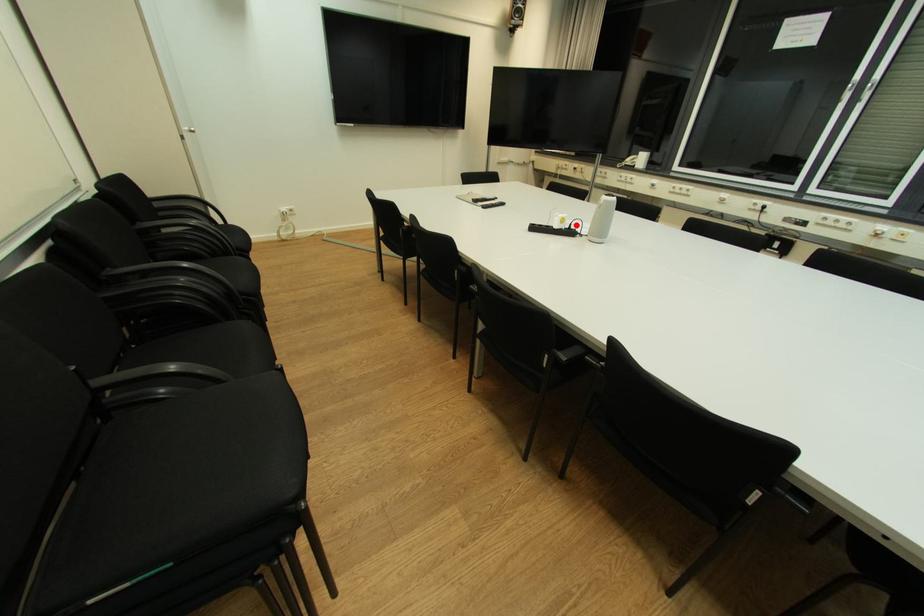
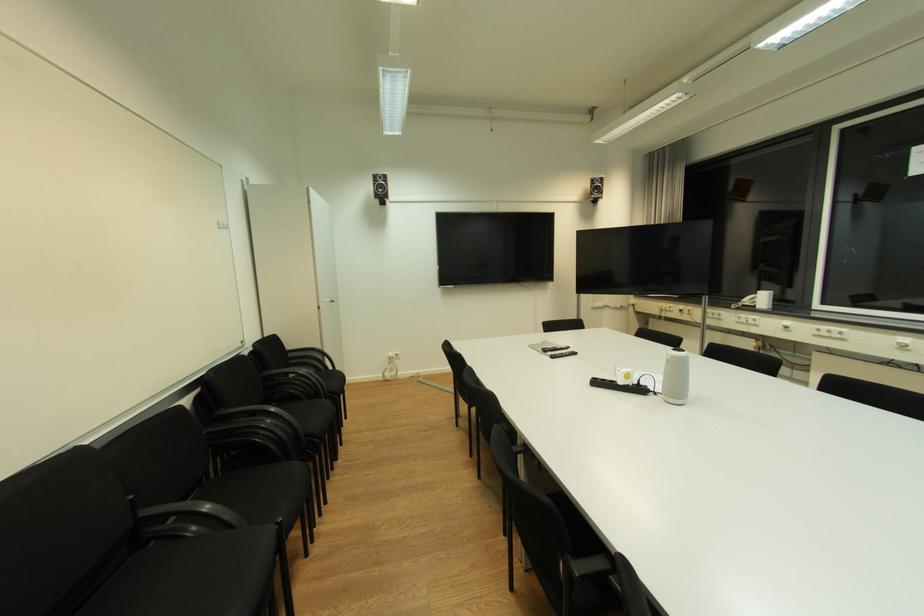
Find the pixel in the second image that matches the highlighted location in the first image.

(645, 381)